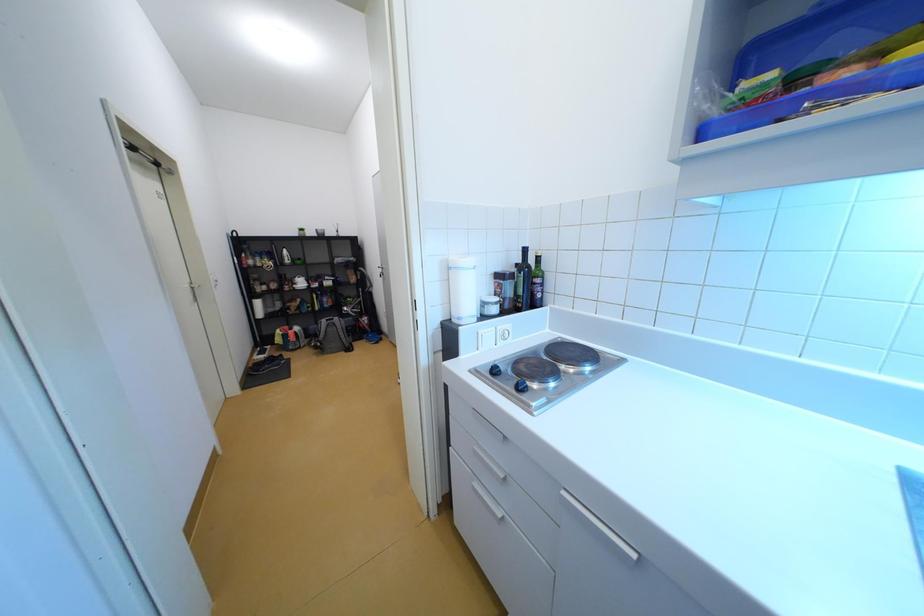
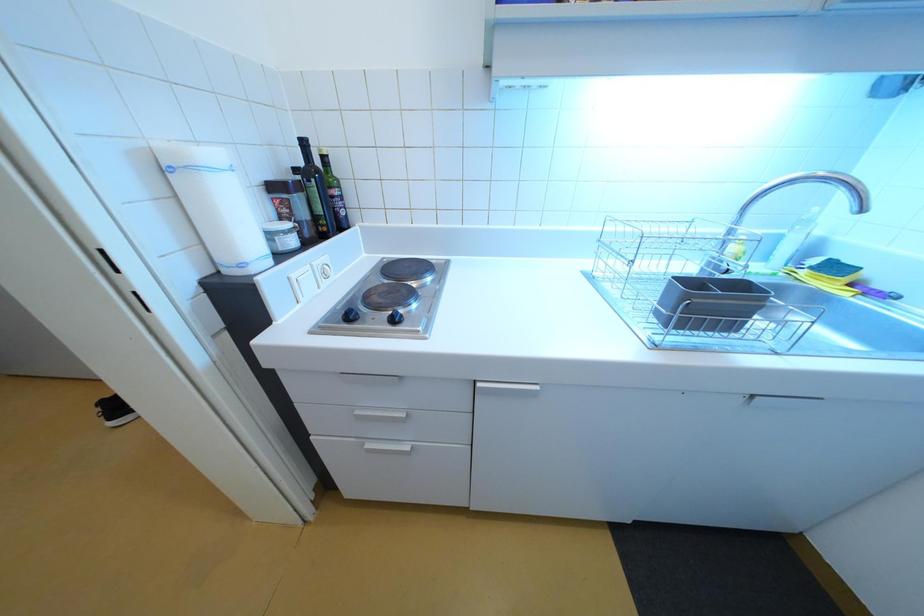
First-person continuous shooting, in which direction is the camera rotating?

The camera rotated toward right-down.